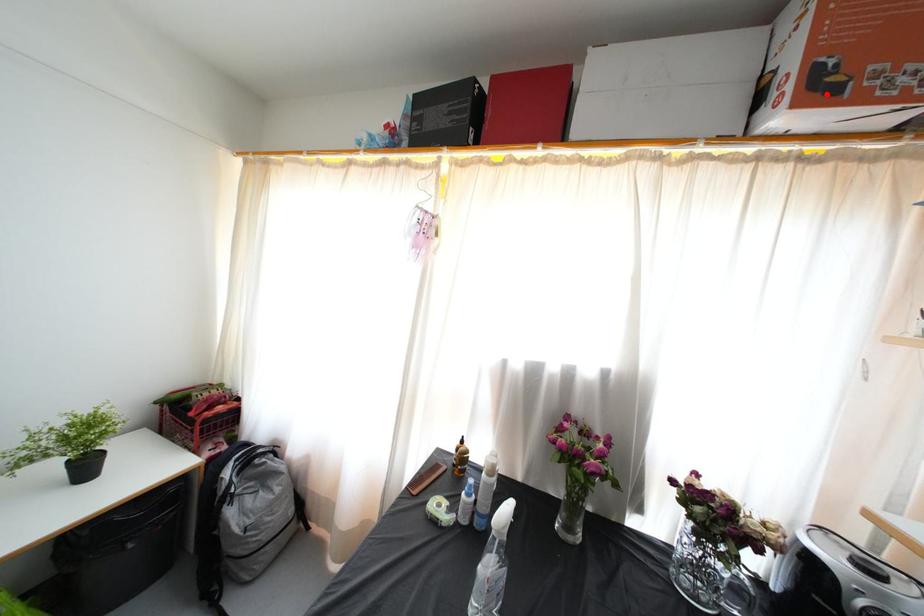
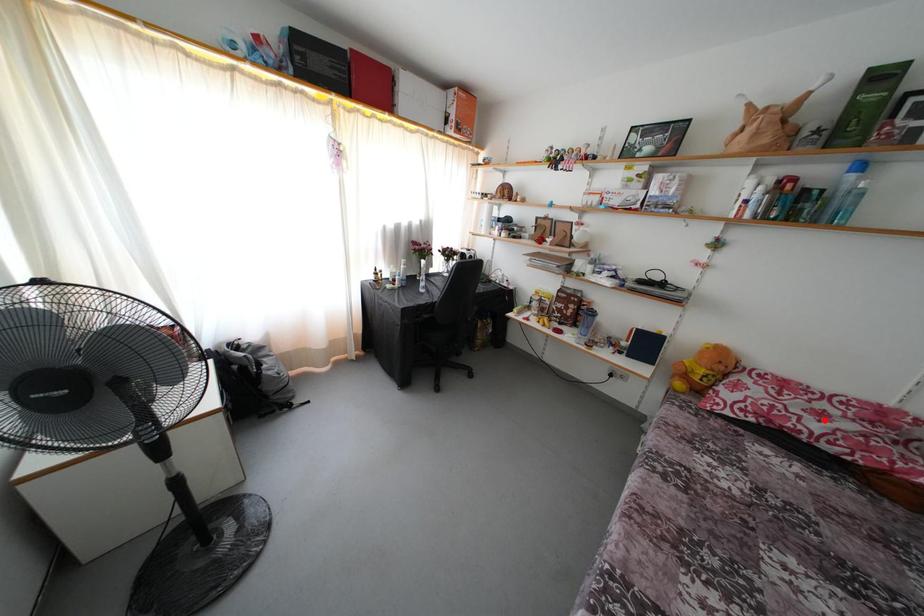
I am providing you with two images of the same scene from different viewpoints. A red point is marked on the first image and another point is marked on the second image. Do the highlighted points in image1 and image2 indicate the same real-world spot?

No